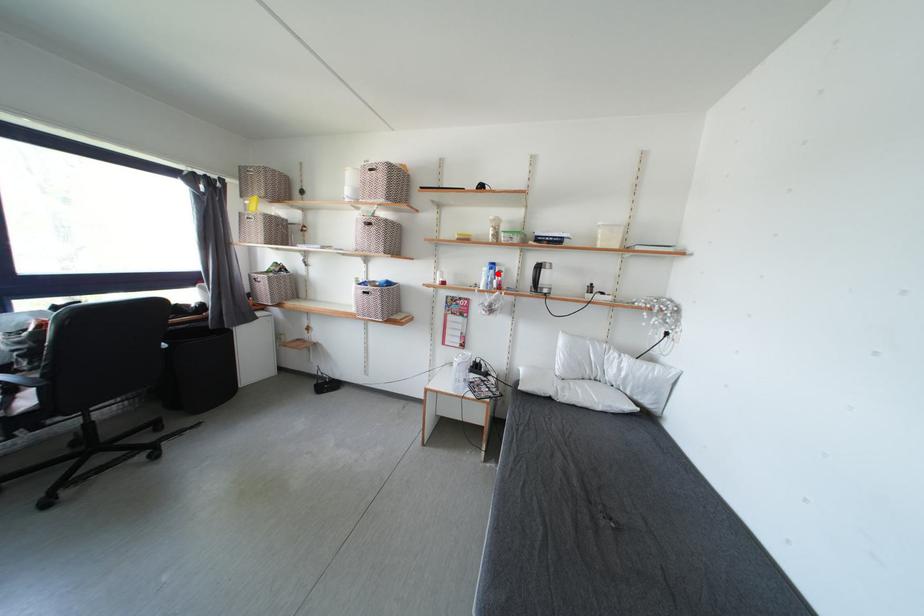
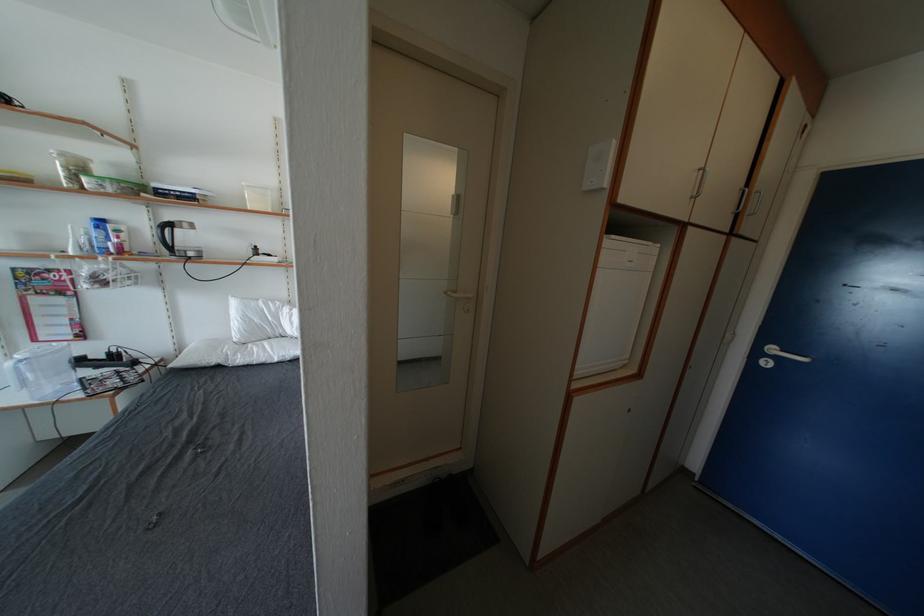
Question: I am providing you with two images of the same scene from different viewpoints. A red point is marked on the first image. At the location where the point appears in image 1, is it still visible in image 2?

Choices:
 (A) Yes
 (B) No

Answer: (A)